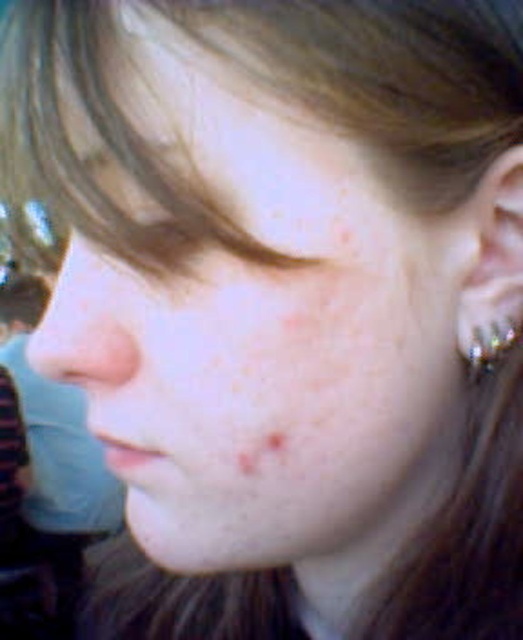
You are a photographer adjusting the lighting for a portrait. You notice the silver metallic earring at right and the brown matte freckle at lower center. Which object is positioned more to the right side of the face?

The silver metallic earring at right is positioned more to the right side of the face than the brown matte freckle at lower center.

You are a photographer adjusting the lighting for a portrait. You notice a point at coordinates [492,340] in the image. Based on the scene, what object is located at that point?

The point at coordinates [492,340] corresponds to the silver metallic earring at right.

You are a makeup artist preparing to apply foundation on the matte skin nose at center and the silver metallic earring at right. Which object is located higher on the face?

The matte skin nose at center is positioned over the silver metallic earring at right, so the matte skin nose at center is higher on the face.